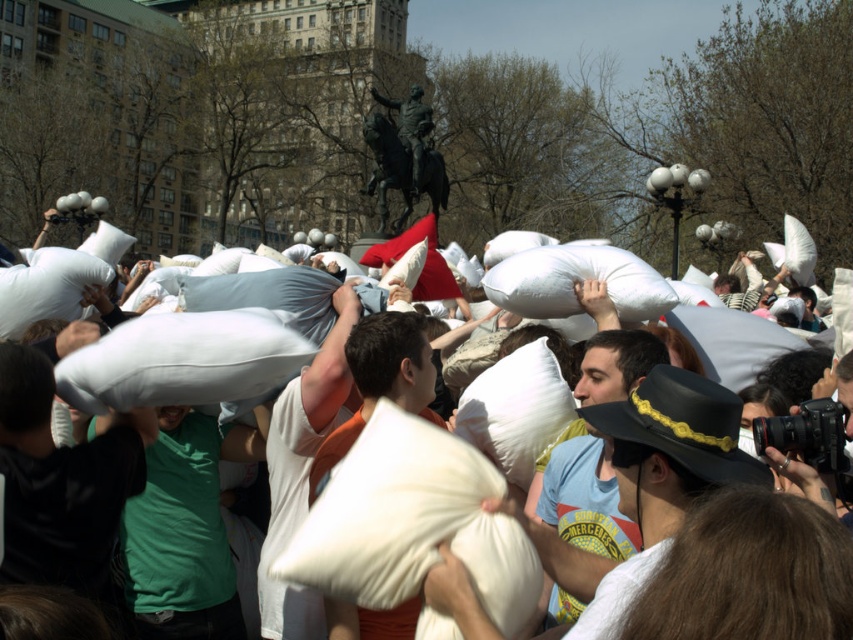
Question: Where is matte black hat at center located in relation to matte white pillow at center in the image?

Choices:
 (A) left
 (B) right

Answer: (A)

Question: Can you confirm if black matte pillow at center is smaller than matte white pillow at center?

Choices:
 (A) no
 (B) yes

Answer: (B)

Question: Which of the following is the farthest from the observer?

Choices:
 (A) (305, 349)
 (B) (550, 621)
 (C) (67, 573)

Answer: (A)

Question: Which of the following is the farthest from the observer?

Choices:
 (A) (769, 483)
 (B) (387, 259)
 (C) (608, 499)
 (D) (50, 394)

Answer: (B)

Question: Does matte black hat at center appear on the right side of matte white pillow at center?

Choices:
 (A) yes
 (B) no

Answer: (B)

Question: Which point is farther from the camera taking this photo?

Choices:
 (A) (9, 401)
 (B) (608, 458)
 (C) (341, 305)

Answer: (C)